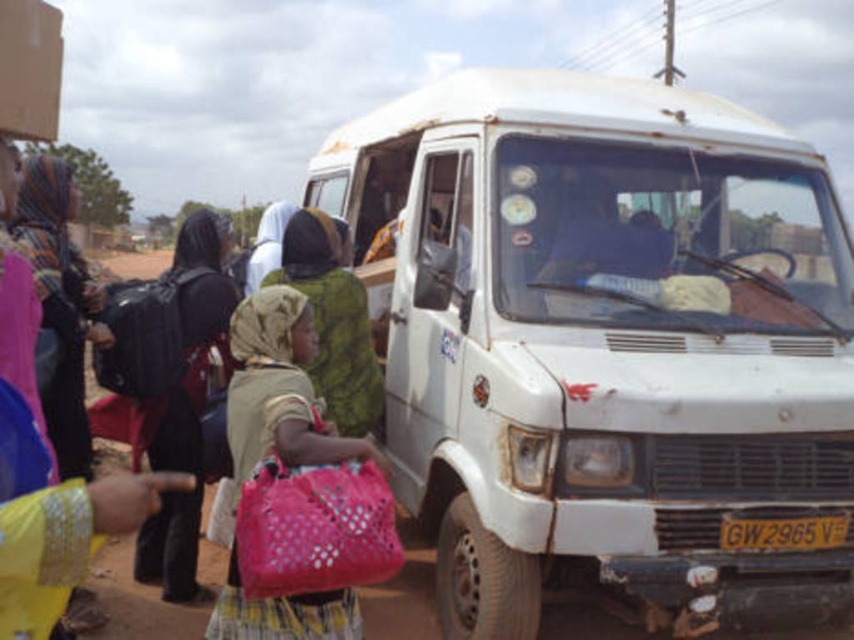
Question: Is black fabric backpack at left positioned in front of pink fabric bag at center?

Choices:
 (A) yes
 (B) no

Answer: (B)

Question: Which object is positioned farthest from the white matte van at center?

Choices:
 (A) cardboard box at upper left
 (B) pink fabric bag at center
 (C) multicolored woven scarf at upper left

Answer: (A)

Question: Based on their relative distances, which object is nearer to the green fabric headscarf at center?

Choices:
 (A) white matte van at center
 (B) multicolored woven scarf at upper left
 (C) black fabric backpack at left

Answer: (C)

Question: Can you confirm if multicolored woven scarf at upper left is positioned to the left of cardboard box at upper left?

Choices:
 (A) no
 (B) yes

Answer: (B)

Question: Which object appears closest to the camera in this image?

Choices:
 (A) green fabric headscarf at center
 (B) white matte van at center
 (C) pink fabric bag at center

Answer: (C)

Question: Does black fabric backpack at left appear over multicolored woven scarf at upper left?

Choices:
 (A) no
 (B) yes

Answer: (A)